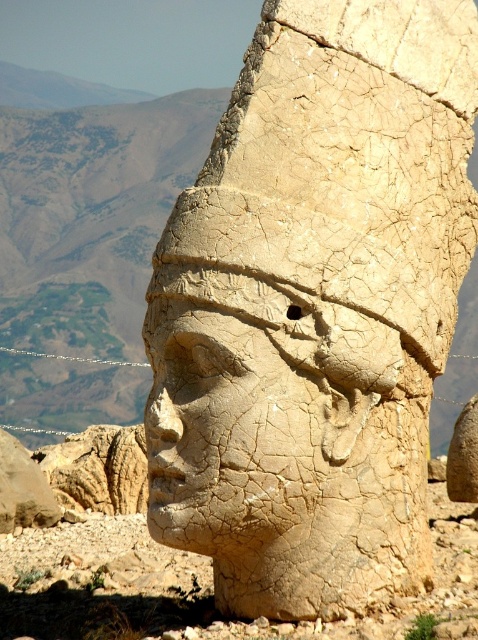
Question: Which point appears farthest from the camera in this image?

Choices:
 (A) (414, 305)
 (B) (198, 342)

Answer: (A)

Question: Does cracked stone head at center appear on the right side of cracked stone face at center?

Choices:
 (A) yes
 (B) no

Answer: (A)

Question: Does cracked stone head at center come behind cracked stone face at center?

Choices:
 (A) no
 (B) yes

Answer: (A)

Question: Can you confirm if cracked stone head at center is wider than cracked stone face at center?

Choices:
 (A) no
 (B) yes

Answer: (B)

Question: Among these points, which one is nearest to the camera?

Choices:
 (A) (234, 548)
 (B) (159, 262)

Answer: (A)